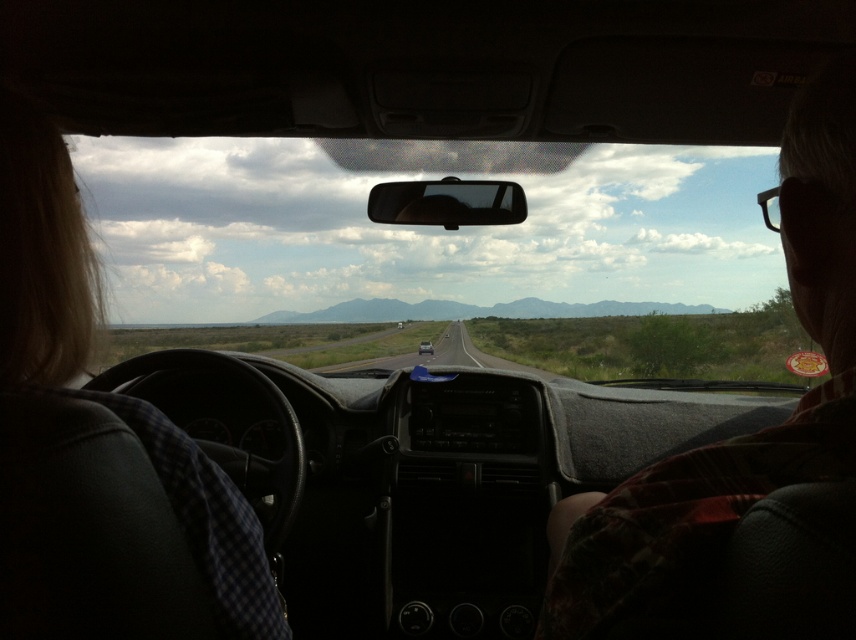
You are a passenger in a car and you see the blonde hair at left and the metallic silver sedan at center. Which object is closer to you?

The blonde hair at left is closer to you because it appears larger in size than the metallic silver sedan at center.

You are a passenger in a car and want to hand a water bottle to the person sitting next to you. The bottle is 10 inches long. Can you reach from the plaid shirt at right to the blonde hair at left without dropping the bottle?

The plaid shirt at right is 27.45 inches from the blonde hair at left, so yes, you can reach from the plaid shirt at right to the blonde hair at left without dropping the bottle since the distance is greater than the bottle length.